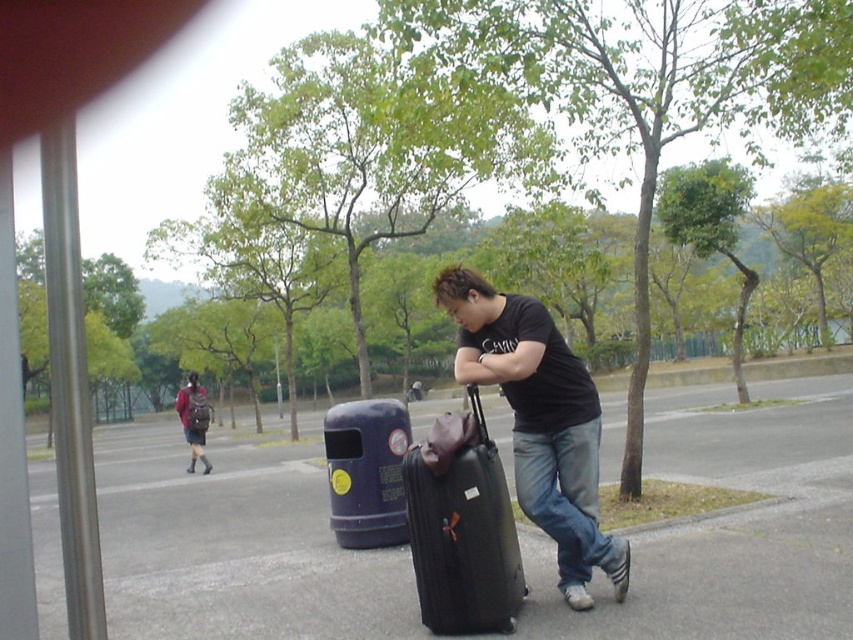
Is black hard suitcase at center shorter than leather suitcase at center?

Incorrect, black hard suitcase at center's height does not fall short of leather suitcase at center's.

Consider the image. Who is shorter, black hard suitcase at center or leather suitcase at center?

With less height is leather suitcase at center.

This screenshot has height=640, width=853. Find the location of `black hard suitcase at center`. black hard suitcase at center is located at coordinates [x=462, y=528].

Which is more to the right, black matte suitcase at center or leather suitcase at center?

black matte suitcase at center is more to the right.

Is black matte suitcase at center taller than leather suitcase at center?

Indeed, black matte suitcase at center has a greater height compared to leather suitcase at center.

Does point (572, 406) come behind point (479, 435)?

Yes, it is.

You are a GUI agent. You are given a task and a screenshot of the screen. Output one action in this format:
    pyautogui.click(x=<x>, y=<y>)
    Task: Click on the black matte suitcase at center
    The image size is (853, 640).
    Given the screenshot: What is the action you would take?
    pyautogui.click(x=538, y=420)

Which is behind, point (492, 372) or point (497, 465)?

The point (497, 465) is behind.

Is black matte suitcase at center below black hard suitcase at center?

Actually, black matte suitcase at center is above black hard suitcase at center.

Where is `black matte suitcase at center`? The width and height of the screenshot is (853, 640). black matte suitcase at center is located at coordinates (538, 420).